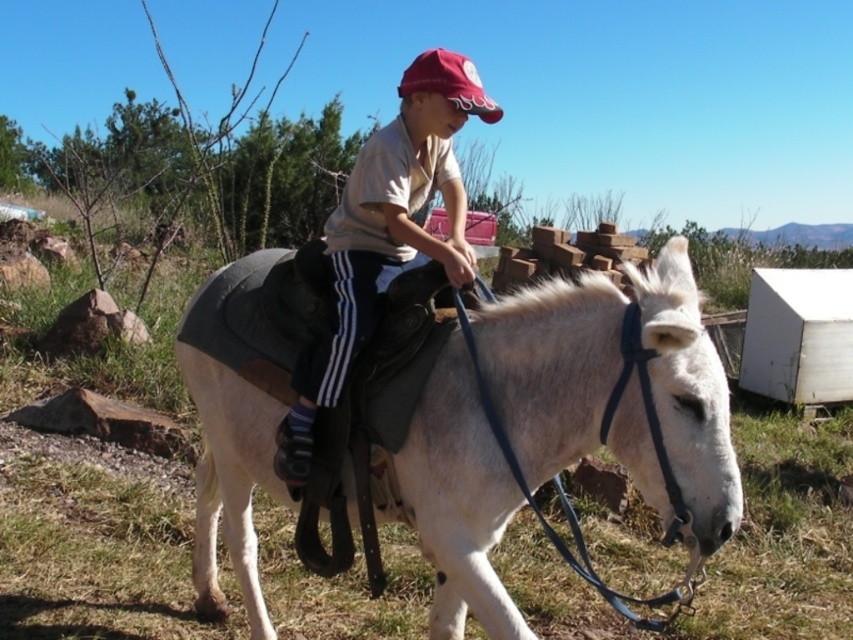
Question: Which of the following is the farthest from the observer?

Choices:
 (A) (451, 104)
 (B) (422, 76)

Answer: (B)

Question: Can you confirm if white matte donkey at center is positioned to the right of matte khaki shirt at center?

Choices:
 (A) yes
 (B) no

Answer: (A)

Question: Which of the following is the closest to the observer?

Choices:
 (A) white matte donkey at center
 (B) matte khaki shirt at center

Answer: (A)

Question: Can you confirm if matte khaki shirt at center is wider than maroon fabric baseball cap at upper center?

Choices:
 (A) no
 (B) yes

Answer: (B)

Question: Does white matte donkey at center appear on the right side of matte khaki shirt at center?

Choices:
 (A) yes
 (B) no

Answer: (A)

Question: Based on their relative distances, which object is nearer to the matte khaki shirt at center?

Choices:
 (A) maroon fabric baseball cap at upper center
 (B) white matte donkey at center

Answer: (A)